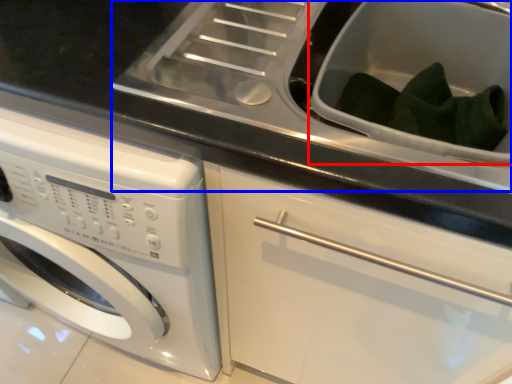
Question: Which point is closer to the camera, sink (highlighted by a red box) or sink (highlighted by a blue box)?

Choices:
 (A) sink
 (B) sink

Answer: (B)